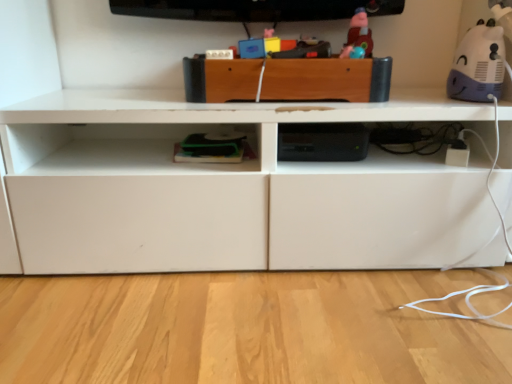
Question: Considering their positions, is wooden drawer at center located in front of or behind matte plastic toy at upper center, marked as the first toy in a left-to-right arrangement?

Choices:
 (A) front
 (B) behind

Answer: (A)

Question: From the image's perspective, is wooden drawer at center positioned above or below matte plastic toy at upper center, which ranks as the 2th toy in right-to-left order?

Choices:
 (A) above
 (B) below

Answer: (B)

Question: Which object is the farthest from the wooden drawer at center?

Choices:
 (A) purple matte plush toy at upper right, the 2th toy in the left-to-right sequence
 (B) matte plastic toy at upper center, marked as the first toy in a left-to-right arrangement

Answer: (A)

Question: Which is nearer to the wooden drawer at center?

Choices:
 (A) matte plastic toy at upper center, which ranks as the 2th toy in right-to-left order
 (B) purple matte plush toy at upper right, the 2th toy in the left-to-right sequence

Answer: (A)